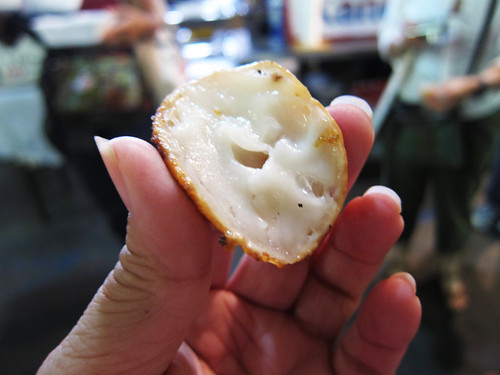
I want to click on broom, so click(x=388, y=101).